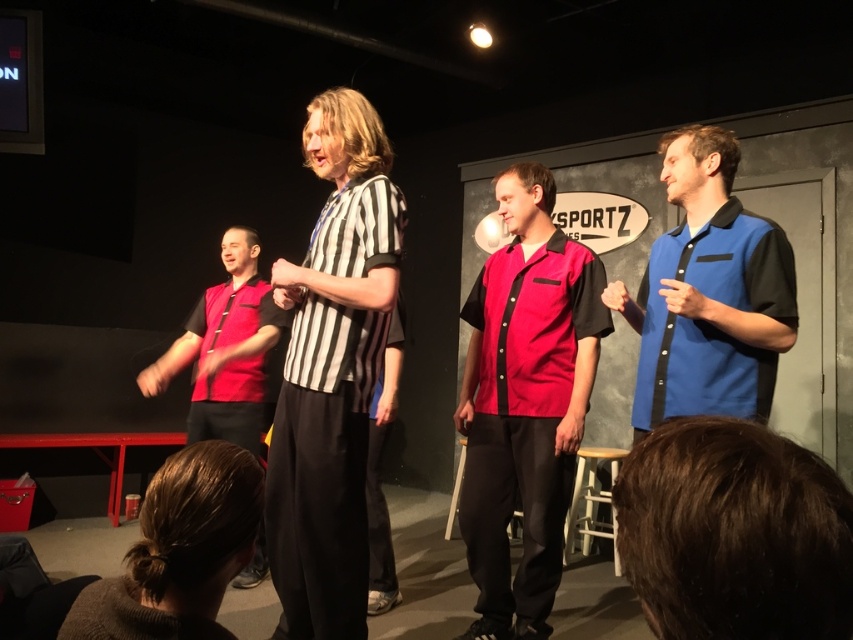
Can you confirm if shiny red bowling shirt at center is positioned above matte red shirt at center?

No, shiny red bowling shirt at center is not above matte red shirt at center.

Who is more forward, (x=486, y=340) or (x=242, y=349)?

Point (x=486, y=340) is in front.

The height and width of the screenshot is (640, 853). What do you see at coordinates (525, 403) in the screenshot?
I see `shiny red bowling shirt at center` at bounding box center [525, 403].

Identify the location of shiny red bowling shirt at center. Image resolution: width=853 pixels, height=640 pixels. (525, 403).

Does black striped shirt at center appear over shiny red bowling shirt at center?

Indeed, black striped shirt at center is positioned over shiny red bowling shirt at center.

Describe the element at coordinates (332, 372) in the screenshot. I see `black striped shirt at center` at that location.

Where is `black striped shirt at center`? This screenshot has height=640, width=853. black striped shirt at center is located at coordinates (332, 372).

The height and width of the screenshot is (640, 853). Identify the location of black striped shirt at center. (332, 372).

Who is positioned more to the left, blue smooth shirt at right or matte red shirt at center?

matte red shirt at center

Does blue smooth shirt at right appear on the right side of matte red shirt at center?

Indeed, blue smooth shirt at right is positioned on the right side of matte red shirt at center.

Where is `blue smooth shirt at right`? The height and width of the screenshot is (640, 853). blue smooth shirt at right is located at coordinates (708, 292).